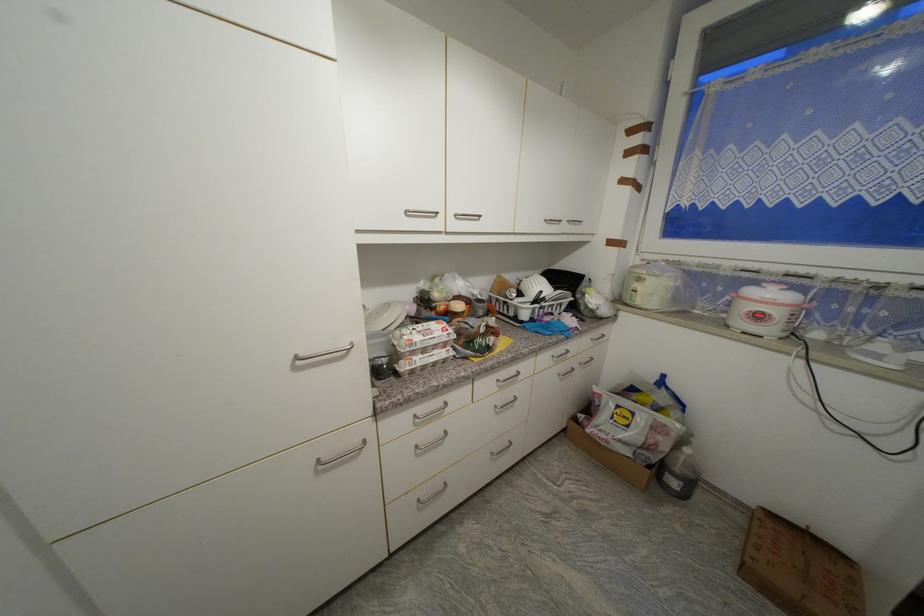
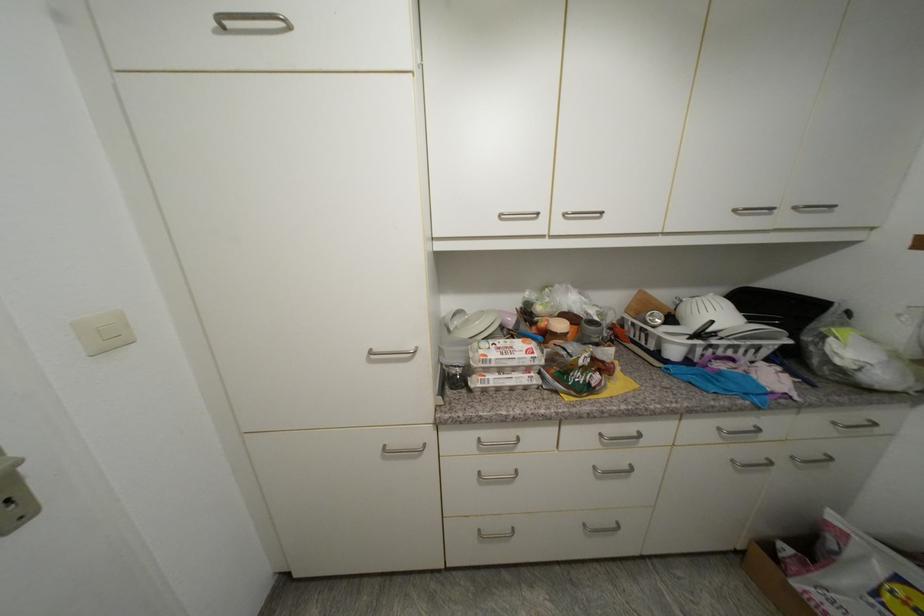
In the second image, find the point that corresponds to (x=393, y=306) in the first image.

(489, 314)